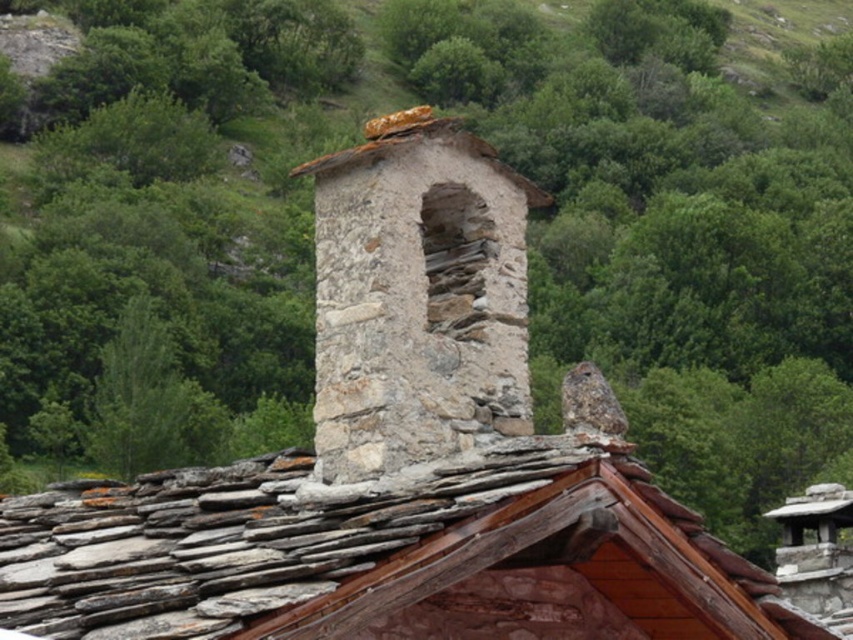
Who is taller, gray slate tiles at center or natural stone chimney at center?

natural stone chimney at center is taller.

At what (x,y) coordinates should I click in order to perform the action: click on gray slate tiles at center. Please return your answer as a coordinate pair (x, y). Image resolution: width=853 pixels, height=640 pixels. Looking at the image, I should click on (384, 554).